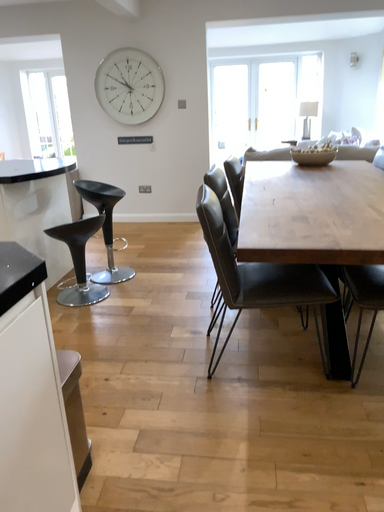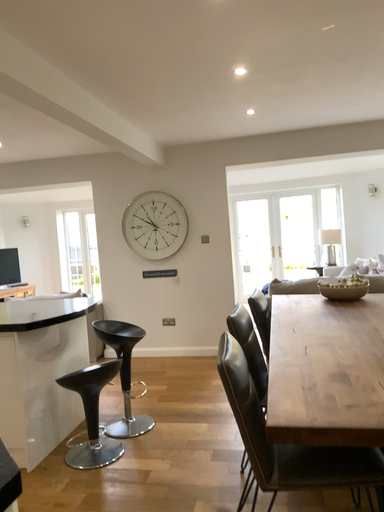
Question: Which way did the camera rotate in the video?

Choices:
 (A) rotated downward
 (B) rotated upward

Answer: (B)